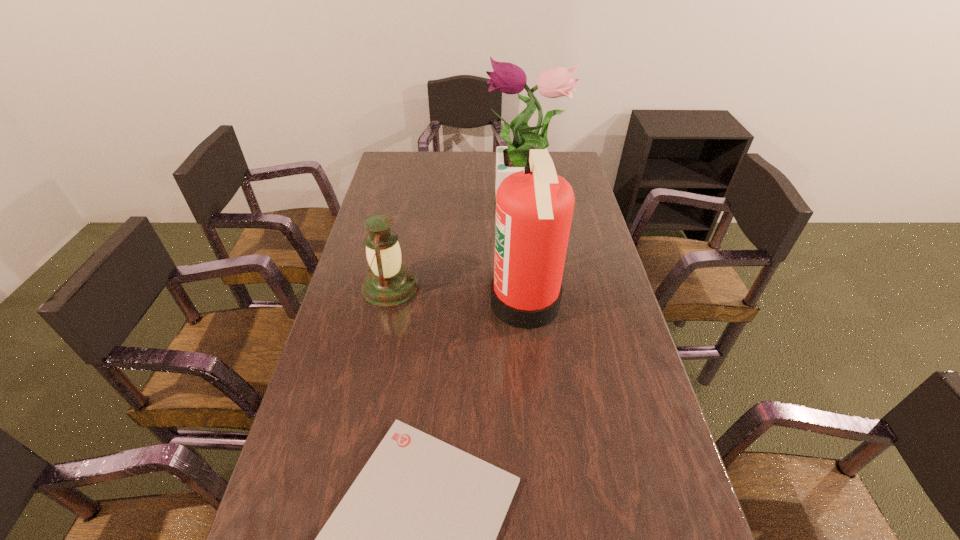
Find the location of a particular element. This screenshot has width=960, height=540. flower arrangement is located at coordinates (508, 78).

Where is `fire extinguisher`? Image resolution: width=960 pixels, height=540 pixels. fire extinguisher is located at coordinates point(534,207).

Image resolution: width=960 pixels, height=540 pixels. Identify the location of lantern. (388, 284).

This screenshot has width=960, height=540. What are the coordinates of `vacant space located on the front-facing side of the flower arrangement` in the screenshot? It's located at (448, 205).

Where is `free space located on the front-facing side of the flower arrangement`? This screenshot has width=960, height=540. free space located on the front-facing side of the flower arrangement is located at coordinates (435, 205).

Locate an element on the screen. vacant space situated on the front-facing side of the flower arrangement is located at coordinates (471, 205).

The image size is (960, 540). What are the coordinates of `free space located 0.160m at the nozzle of the fire extinguisher` in the screenshot? It's located at (437, 303).

The image size is (960, 540). I want to click on vacant area situated 0.190m at the nozzle of the fire extinguisher, so click(x=426, y=303).

What are the coordinates of `vacant space located at the nozzle of the fire extinguisher` in the screenshot? It's located at (426, 303).

Find the location of a particular element. vacant space located 0.230m with the light compartment facing forward on the lantern is located at coordinates (494, 287).